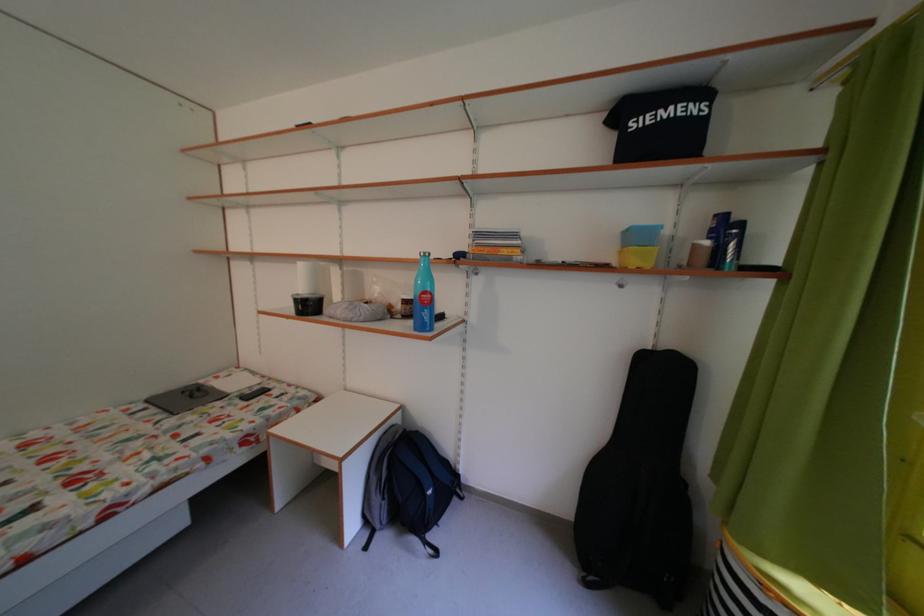
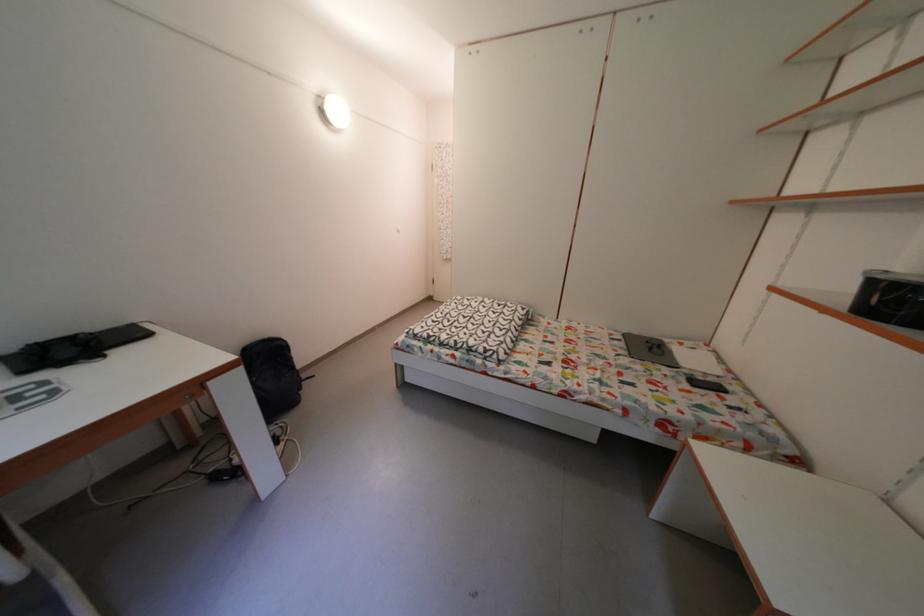
How did the camera likely rotate?

The camera's rotation is toward left-down.